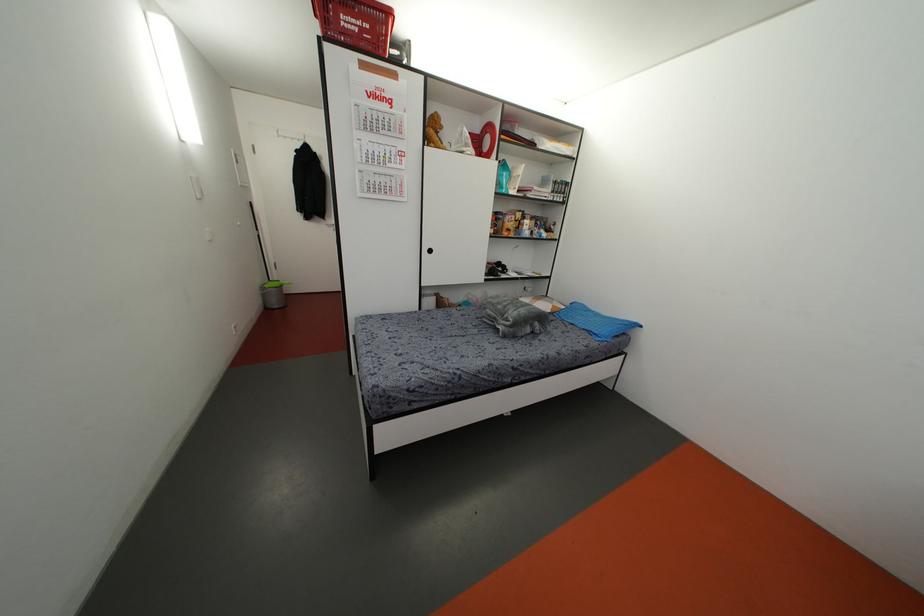
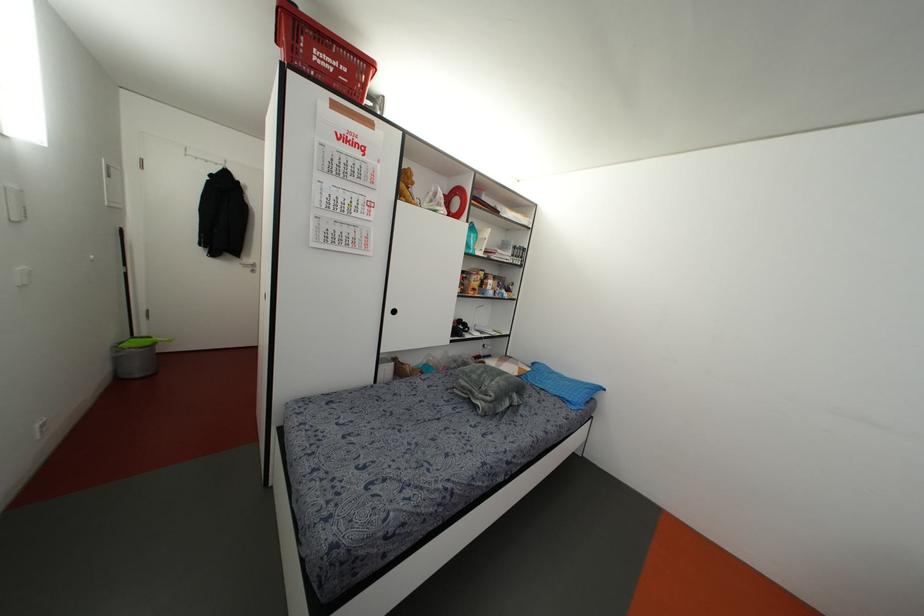
Locate, in the second image, the point that corresponds to pixel 430 251 in the first image.

(394, 310)